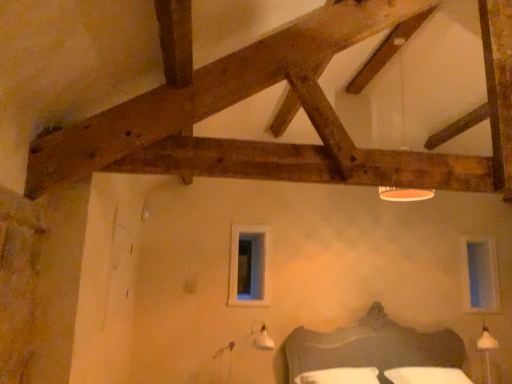
Question: Is dark gray wooden bed at lower center located outside white plastic lampshade at upper center?

Choices:
 (A) yes
 (B) no

Answer: (A)

Question: Can you confirm if dark gray wooden bed at lower center is wider than white plastic lampshade at upper center?

Choices:
 (A) no
 (B) yes

Answer: (B)

Question: Is white plastic lampshade at upper center completely or partially inside dark gray wooden bed at lower center?

Choices:
 (A) no
 (B) yes

Answer: (A)

Question: From the image's perspective, is dark gray wooden bed at lower center on top of white plastic lampshade at upper center?

Choices:
 (A) no
 (B) yes

Answer: (A)

Question: Considering the relative positions of dark gray wooden bed at lower center and white plastic lampshade at upper center in the image provided, is dark gray wooden bed at lower center to the right of white plastic lampshade at upper center from the viewer's perspective?

Choices:
 (A) no
 (B) yes

Answer: (B)

Question: Is dark gray wooden bed at lower center thinner than white plastic lampshade at upper center?

Choices:
 (A) no
 (B) yes

Answer: (A)

Question: Considering the relative sizes of white plastic lampshade at upper center and clear glass window at upper right, which is the second window from front to back, in the image provided, is white plastic lampshade at upper center smaller than clear glass window at upper right, which is the second window from front to back,?

Choices:
 (A) no
 (B) yes

Answer: (A)

Question: Does white plastic lampshade at upper center appear on the right side of clear glass window at upper right, which is the second window from front to back?

Choices:
 (A) yes
 (B) no

Answer: (B)

Question: Is there a large distance between white plastic lampshade at upper center and clear glass window at upper right, which appears as the first window when viewed from the right?

Choices:
 (A) no
 (B) yes

Answer: (B)

Question: Is white plastic lampshade at upper center surrounding clear glass window at upper right, which appears as the first window when viewed from the right?

Choices:
 (A) no
 (B) yes

Answer: (A)

Question: Is white plastic lampshade at upper center at the left side of clear glass window at upper right, acting as the 2th window starting from the left?

Choices:
 (A) no
 (B) yes

Answer: (B)

Question: From the image's perspective, is white plastic lampshade at upper center below clear glass window at upper right, acting as the 2th window starting from the left?

Choices:
 (A) yes
 (B) no

Answer: (B)

Question: From the image's perspective, would you say white cotton bedding at lower center is positioned over clear glass window at upper right, which is the 1th window in back-to-front order?

Choices:
 (A) no
 (B) yes

Answer: (A)